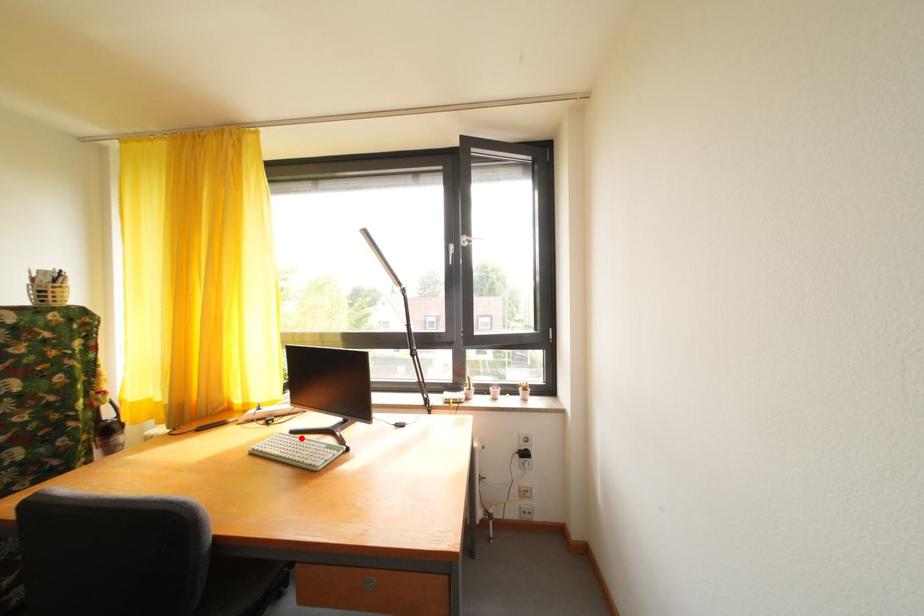
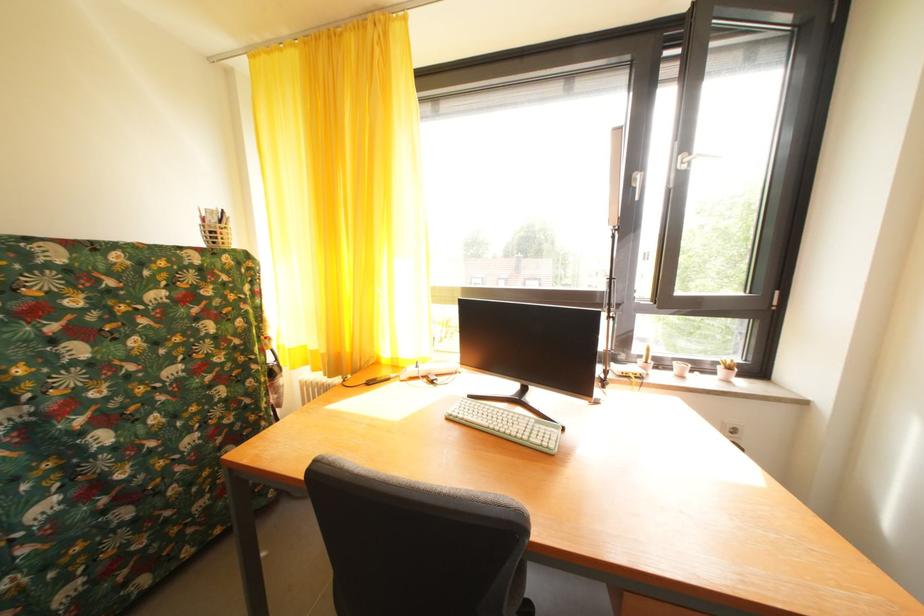
The point at the highlighted location is marked in the first image. Where is the corresponding point in the second image?

(479, 402)